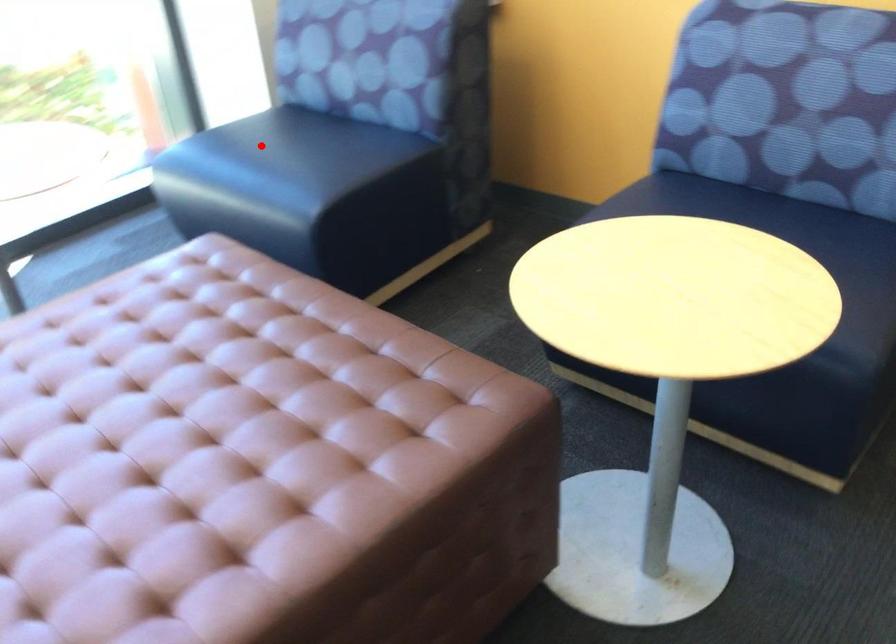
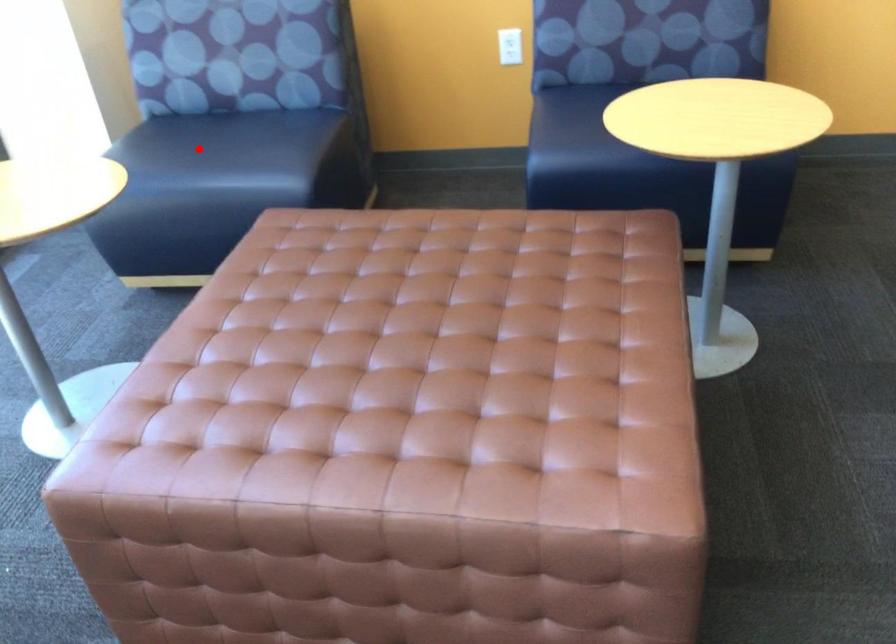
I am providing you with two images of the same scene from different viewpoints. A red point is marked on the first image and another point is marked on the second image. Is the marked point in image1 the same physical position as the marked point in image2?

Yes